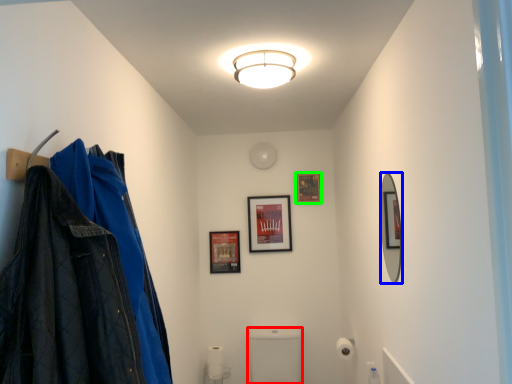
Question: Which object is positioned farthest from toilet bowl (highlighted by a red box)? Select from mirror (highlighted by a blue box) and picture frame (highlighted by a green box).

Choices:
 (A) mirror
 (B) picture frame

Answer: (A)